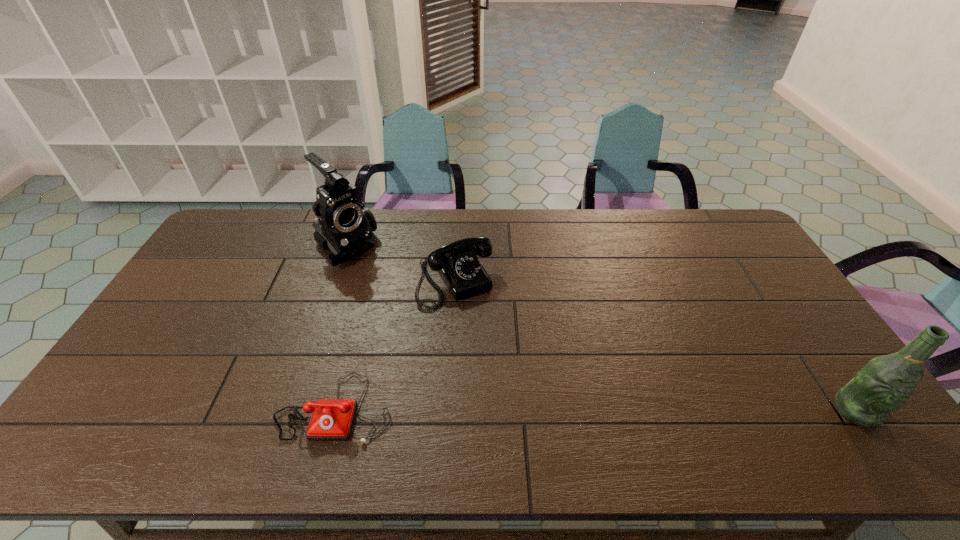
In order to click on free location at the right edge in this screenshot , I will do `click(764, 333)`.

You are a GUI agent. You are given a task and a screenshot of the screen. Output one action in this format:
    pyautogui.click(x=<x>, y=<y>)
    Task: Click on the free space at the far right corner
    
    Given the screenshot: What is the action you would take?
    pyautogui.click(x=696, y=209)

Where is `vacant space in between the beer bottle and the right telephone`? vacant space in between the beer bottle and the right telephone is located at coordinates (656, 346).

The height and width of the screenshot is (540, 960). What are the coordinates of `vacant space that is in between the third object from left to right and the rightmost object` in the screenshot? It's located at (656, 346).

Where is `vacant point located between the camcorder and the nearer telephone`? The image size is (960, 540). vacant point located between the camcorder and the nearer telephone is located at coordinates (x=341, y=327).

You are a GUI agent. You are given a task and a screenshot of the screen. Output one action in this format:
    pyautogui.click(x=<x>, y=<y>)
    Task: Click on the free point between the left telephone and the camcorder
    This screenshot has width=960, height=540.
    Given the screenshot: What is the action you would take?
    pyautogui.click(x=341, y=327)

At what (x,y) coordinates should I click in order to perform the action: click on free space that is in between the shorter telephone and the third tallest object. Please return your answer as a coordinate pair (x, y). The width and height of the screenshot is (960, 540). Looking at the image, I should click on (396, 345).

Locate an element on the screen. This screenshot has width=960, height=540. vacant point located between the nearer telephone and the camcorder is located at coordinates (341, 327).

The height and width of the screenshot is (540, 960). I want to click on free area in between the shorter telephone and the third tallest object, so click(x=396, y=345).

Locate an element on the screen. blank region between the beer bottle and the second object from right to left is located at coordinates (656, 346).